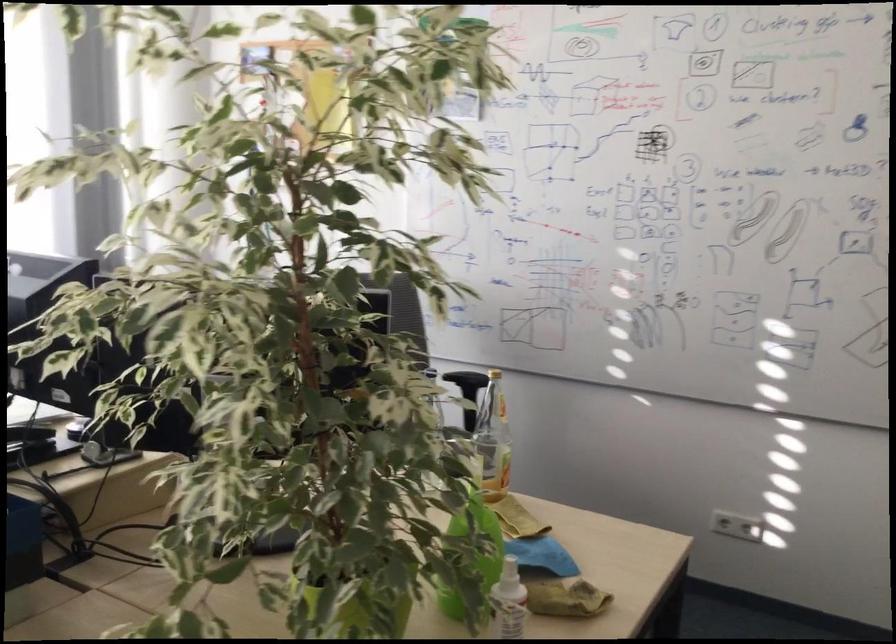
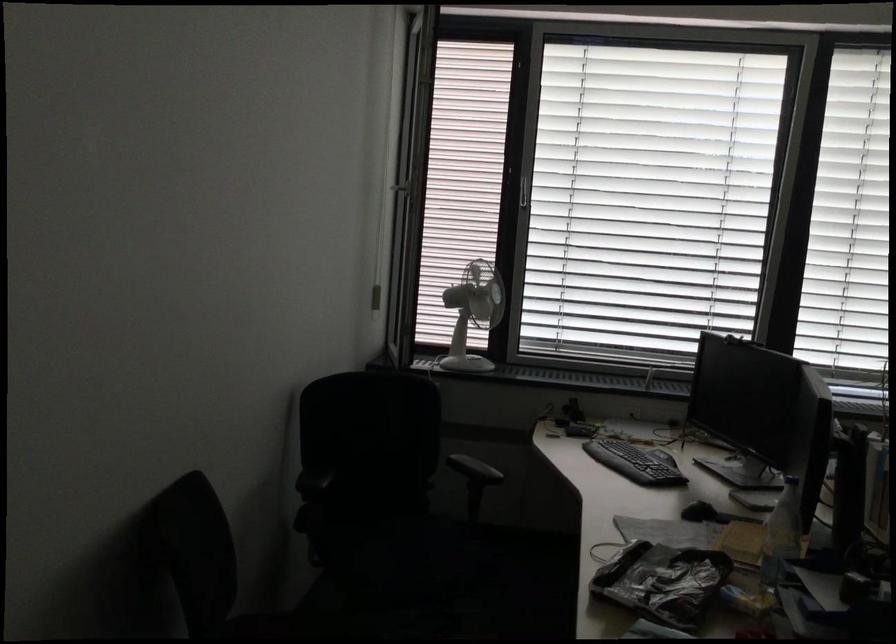
Question: How did the camera likely rotate?

Choices:
 (A) Left
 (B) Right
 (C) Up
 (D) Down

Answer: (A)